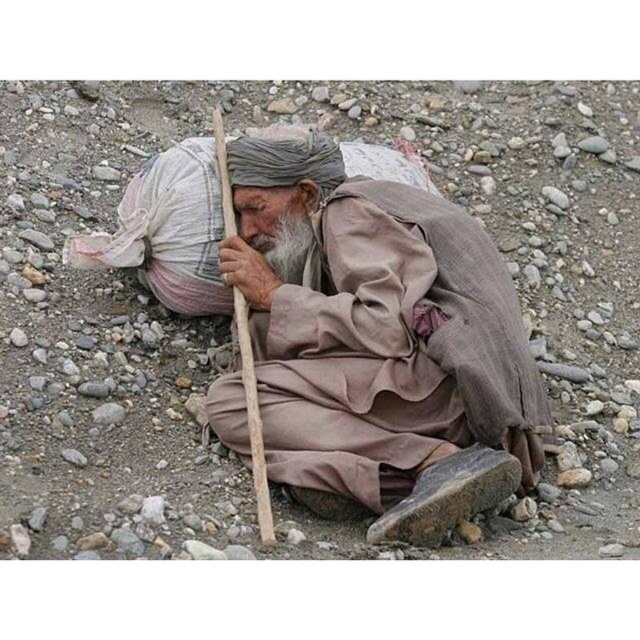
You are standing in front of the image and want to determine which of the two points, point (476, 364) or point (308, 225), is nearer to you. Based on the scene, which point is closer?

Point (476, 364) is closer to the viewer than point (308, 225).